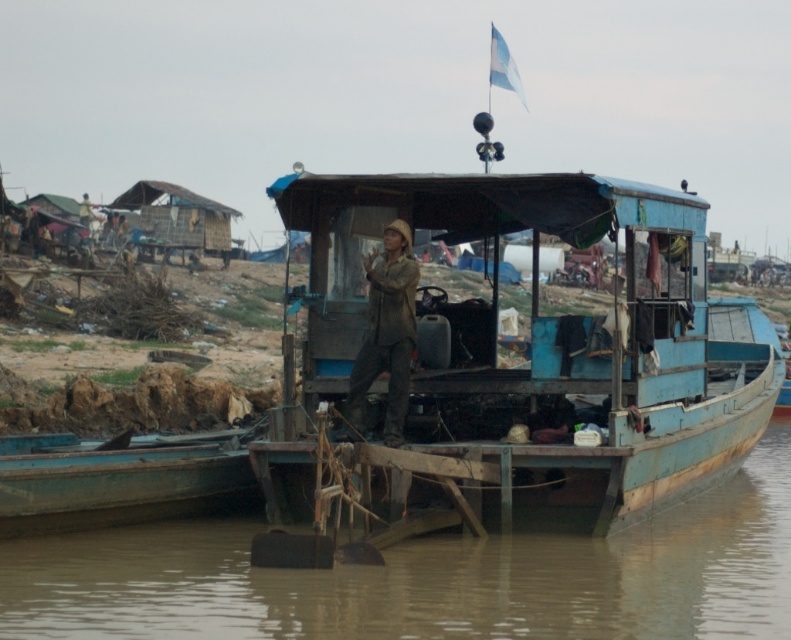
The width and height of the screenshot is (791, 640). Describe the element at coordinates (430, 579) in the screenshot. I see `brown wooden river at center` at that location.

Does brown wooden river at center appear on the right side of brown fabric hat at center?

Yes, brown wooden river at center is to the right of brown fabric hat at center.

Is point (95, 627) positioned after point (407, 252)?

No, it is not.

At what (x,y) coordinates should I click in order to perform the action: click on brown wooden river at center. Please return your answer as a coordinate pair (x, y). This screenshot has height=640, width=791. Looking at the image, I should click on (430, 579).

Does point (458, 486) come behind point (788, 628)?

Yes, it is.

Is point (547, 179) positioned behind point (733, 545)?

No.

This screenshot has width=791, height=640. In order to click on blue matte boat at center in this screenshot , I will do point(505,369).

Who is positioned more to the right, blue matte boat at center or brown fabric hat at center?

blue matte boat at center is more to the right.

Can you confirm if blue matte boat at center is positioned to the left of brown fabric hat at center?

No, blue matte boat at center is not to the left of brown fabric hat at center.

Does point (339, 349) come in front of point (396, 269)?

That is False.

In order to click on blue matte boat at center in this screenshot , I will do `click(505, 369)`.